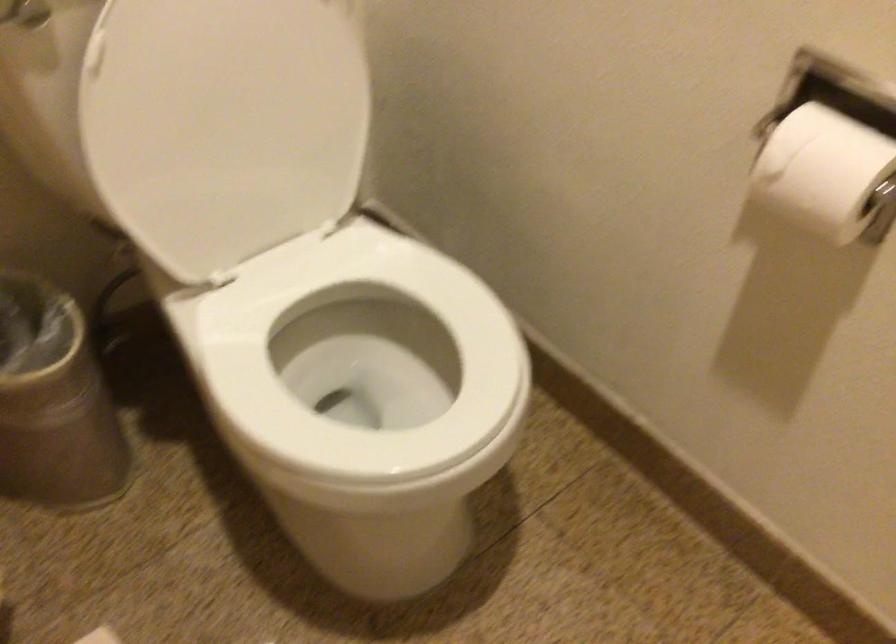
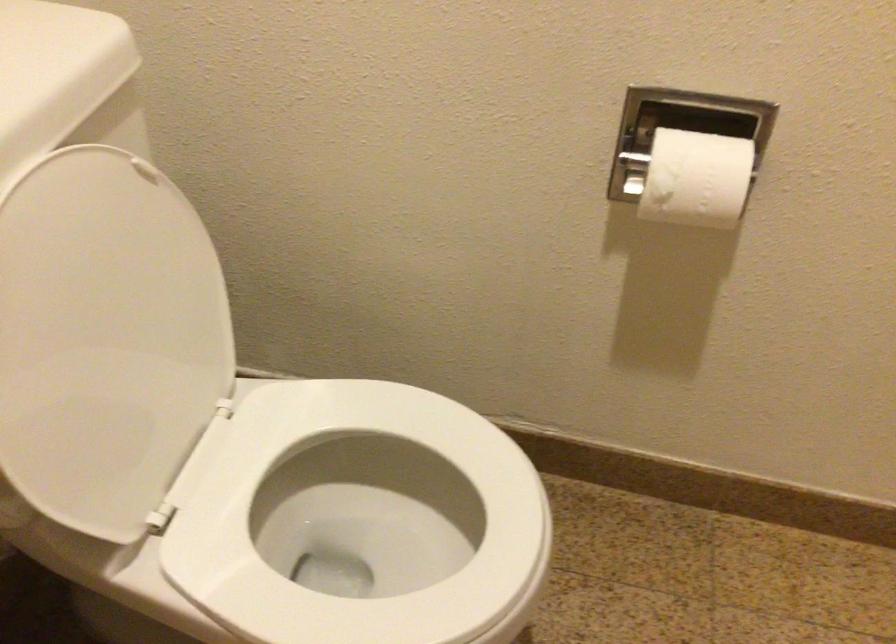
Locate, in the second image, the point that corresponds to [225,109] in the first image.

(105, 339)